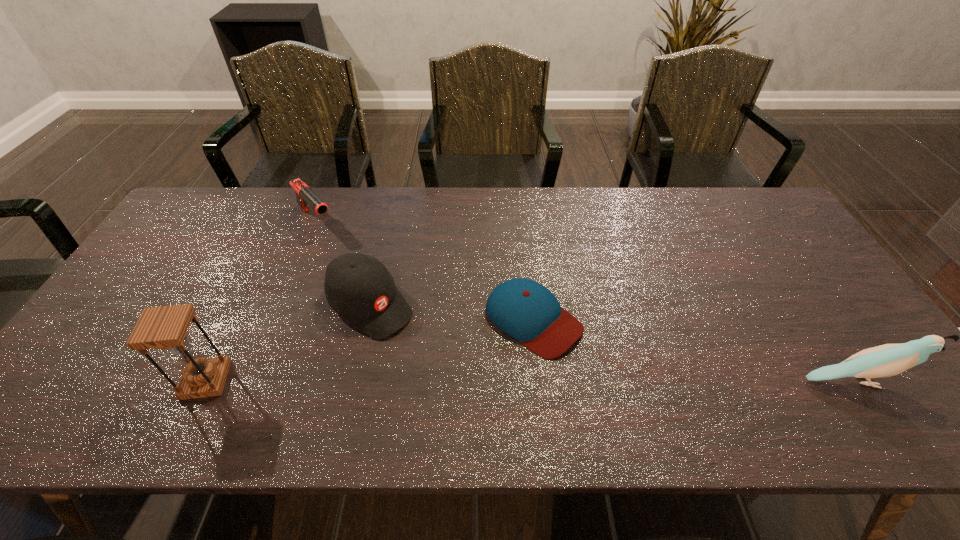
Where is `free point between the tallest object and the gun`? The width and height of the screenshot is (960, 540). free point between the tallest object and the gun is located at coordinates (261, 301).

The image size is (960, 540). Identify the location of free point between the second object from right to left and the taller baseball cap. (452, 313).

Identify the location of empty space between the bird and the shortest object. The height and width of the screenshot is (540, 960). (694, 350).

You are a GUI agent. You are given a task and a screenshot of the screen. Output one action in this format:
    pyautogui.click(x=<x>, y=<y>)
    Task: Click on the unoccupied area between the taller baseball cap and the fourth object from left to right
    This screenshot has height=540, width=960.
    Given the screenshot: What is the action you would take?
    pyautogui.click(x=452, y=313)

Locate an element on the screen. This screenshot has width=960, height=540. vacant area that lies between the shorter baseball cap and the third object from right to left is located at coordinates (452, 313).

I want to click on free space that is in between the farthest object and the shortest object, so click(x=425, y=271).

At what (x,y) coordinates should I click in order to perform the action: click on vacant area between the shortest object and the taller baseball cap. Please return your answer as a coordinate pair (x, y). Looking at the image, I should click on (452, 313).

The width and height of the screenshot is (960, 540). In order to click on object that can be found as the second closest to the third object from right to left in this screenshot , I will do `click(165, 327)`.

Select which object appears as the fourth closest to the tallest object. Please provide its 2D coordinates. Your answer should be formatted as a tuple, i.e. [(x, y)], where the tuple contains the x and y coordinates of a point satisfying the conditions above.

[(887, 360)]

Locate an element on the screen. This screenshot has width=960, height=540. free space that satisfies the following two spatial constraints: 1. on the front side of the hourglass; 2. at the face of the rightmost object is located at coordinates (205, 381).